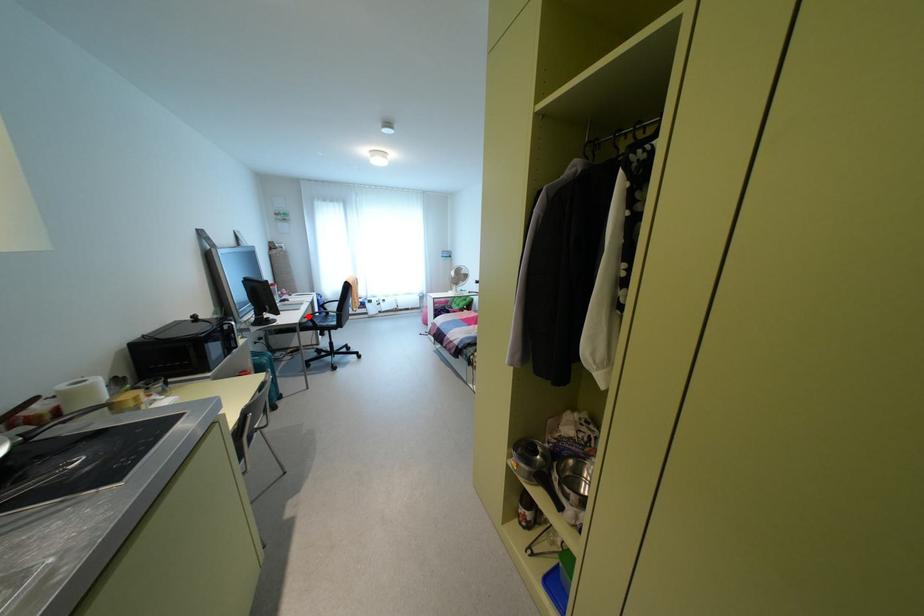
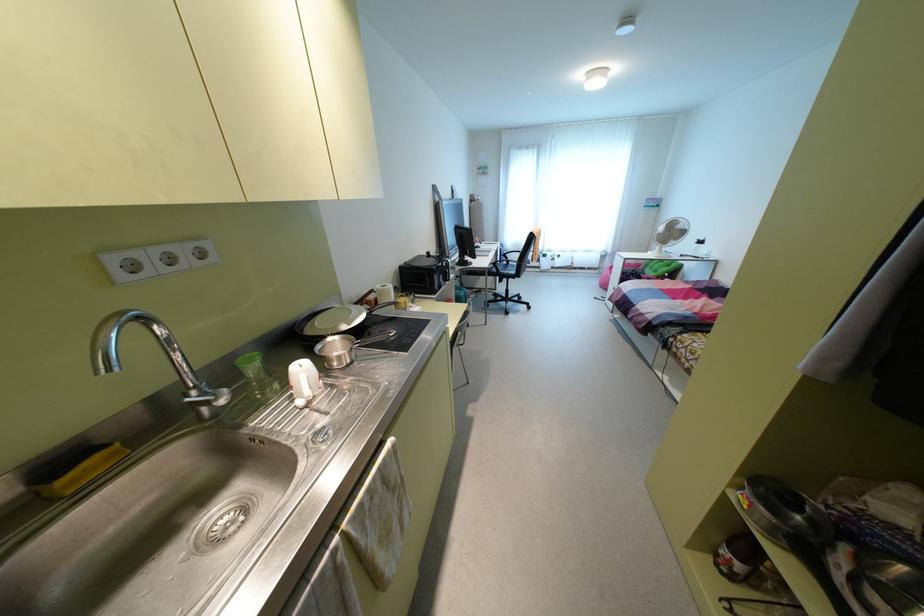
Locate, in the second image, the point that corresponds to the highlighted location in the first image.

(493, 262)